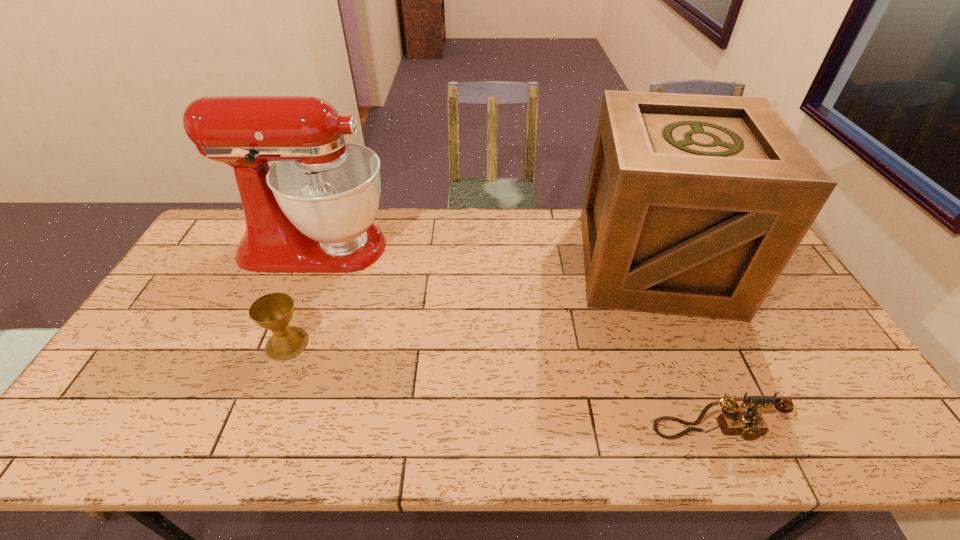
At what (x,y) coordinates should I click in order to perform the action: click on object that is at the left edge. Please return your answer as a coordinate pair (x, y). Looking at the image, I should click on (311, 211).

Where is `object present at the right edge`? object present at the right edge is located at coordinates (694, 204).

You are a GUI agent. You are given a task and a screenshot of the screen. Output one action in this format:
    pyautogui.click(x=<x>, y=<y>)
    Task: Click on the object situated at the far left corner
    
    Given the screenshot: What is the action you would take?
    pyautogui.click(x=311, y=211)

Image resolution: width=960 pixels, height=540 pixels. In order to click on object present at the far right corner in this screenshot , I will do click(x=694, y=204).

You are a GUI agent. You are given a task and a screenshot of the screen. Output one action in this format:
    pyautogui.click(x=<x>, y=<y>)
    Task: Click on the vacant space at the far edge of the desktop
    This screenshot has height=540, width=960.
    Given the screenshot: What is the action you would take?
    pyautogui.click(x=483, y=214)

The height and width of the screenshot is (540, 960). What are the coordinates of `vacant space at the near edge of the desktop` in the screenshot? It's located at (397, 446).

Image resolution: width=960 pixels, height=540 pixels. In the image, there is a desktop. Identify the location of vacant area at the left edge. 223,275.

This screenshot has width=960, height=540. I want to click on empty space between the mixer and the chalice, so click(301, 295).

Locate an element on the screen. Image resolution: width=960 pixels, height=540 pixels. empty space that is in between the mixer and the telephone is located at coordinates (515, 339).

At what (x,y) coordinates should I click in order to perform the action: click on free space between the box and the nearest object. Please return your answer as a coordinate pair (x, y). Looking at the image, I should click on (684, 346).